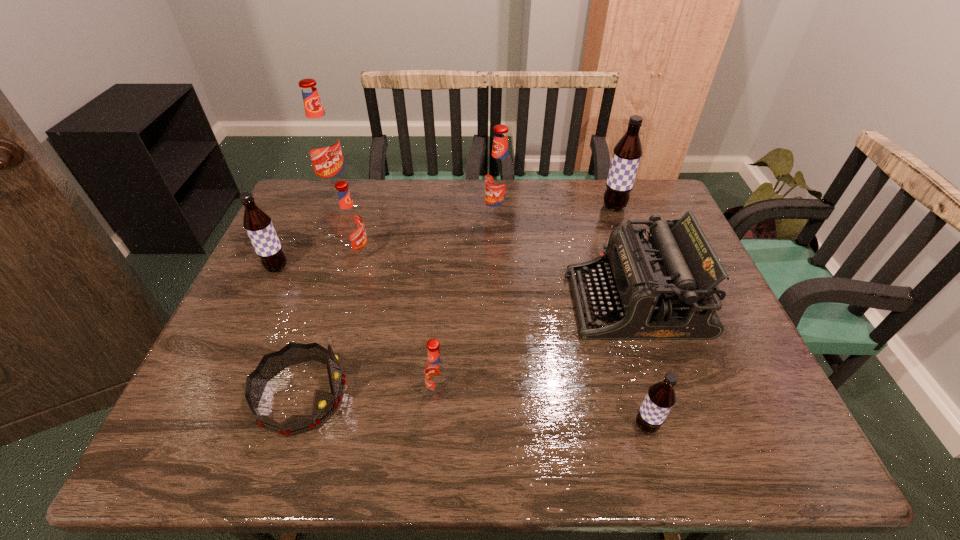
Find the location of a particular element. The height and width of the screenshot is (540, 960). vacant space at the near right corner of the desktop is located at coordinates (789, 452).

Identify the location of vacant point located between the rightmost brown root beer and the second nearest red root beer. (487, 231).

This screenshot has width=960, height=540. Identify the location of vacant space that is in between the second farthest brown root beer and the nearest red root beer. (358, 330).

This screenshot has height=540, width=960. I want to click on unoccupied position between the third biggest red root beer and the shortest object, so pyautogui.click(x=330, y=325).

You are a GUI agent. You are given a task and a screenshot of the screen. Output one action in this format:
    pyautogui.click(x=<x>, y=<y>)
    Task: Click on the free space between the farthest object and the shortest object
    This screenshot has width=960, height=540.
    Given the screenshot: What is the action you would take?
    pyautogui.click(x=319, y=292)

You are a GUI agent. You are given a task and a screenshot of the screen. Output one action in this format:
    pyautogui.click(x=<x>, y=<y>)
    Task: Click on the empty space that is in between the typewriter and the farthest object
    The width and height of the screenshot is (960, 540).
    Given the screenshot: What is the action you would take?
    pyautogui.click(x=485, y=245)

Locate an element on the screen. This screenshot has width=960, height=540. free spot between the typewriter and the shortest object is located at coordinates (468, 349).

Where is `free space between the farthest root beer and the typewriter`? The height and width of the screenshot is (540, 960). free space between the farthest root beer and the typewriter is located at coordinates (485, 245).

Locate an element on the screen. This screenshot has height=540, width=960. vacant point located between the second biggest brown root beer and the farthest object is located at coordinates (306, 228).

The width and height of the screenshot is (960, 540). Identify the location of vacant area that lies between the red tiara and the fourth object from right to left. (399, 306).